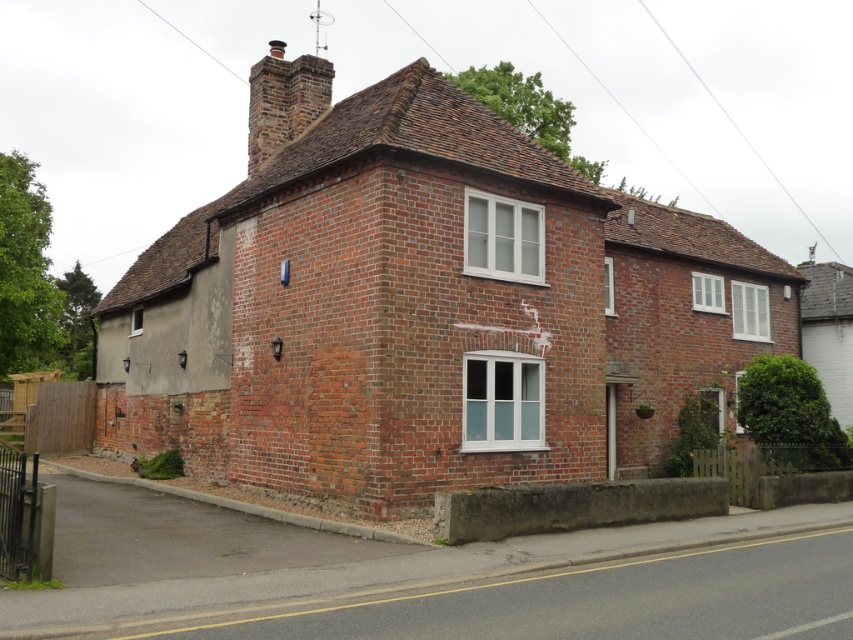
Looking at this image, you are a painter planning to paint both the brick chimney at upper center and the gray concrete chimney at upper right. Which chimney requires more paint because of its size?

The brick chimney at upper center requires more paint because its width is larger than the gray concrete chimney at upper right.

You are a painter who needs to know which structure is shorter between the red brick house at center and the brick chimney at upper center. Which one should you focus on first if you want to paint the shorter one?

The red brick house at center is shorter than the brick chimney at upper center, so you should focus on painting the red brick house at center first.